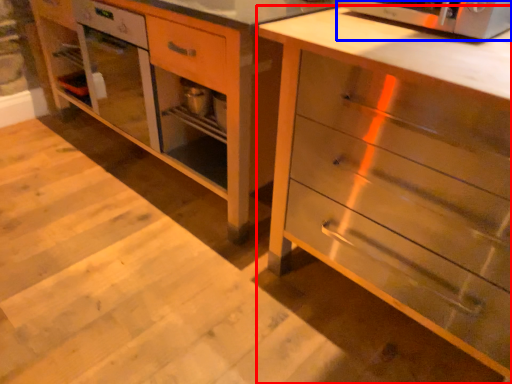
Question: Which object is closer to the camera taking this photo, chest of drawers (highlighted by a red box) or microwave oven (highlighted by a blue box)?

Choices:
 (A) chest of drawers
 (B) microwave oven

Answer: (A)